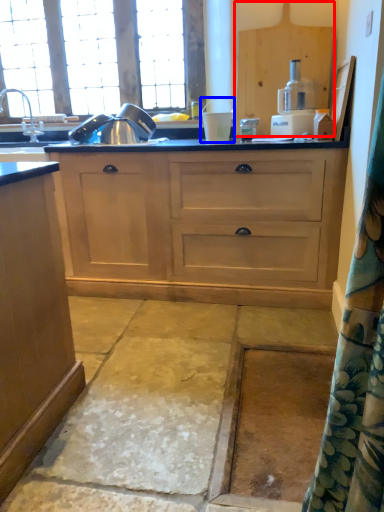
Question: Which point is further to the camera, cabinetry (highlighted by a red box) or appliance (highlighted by a blue box)?

Choices:
 (A) cabinetry
 (B) appliance

Answer: (A)